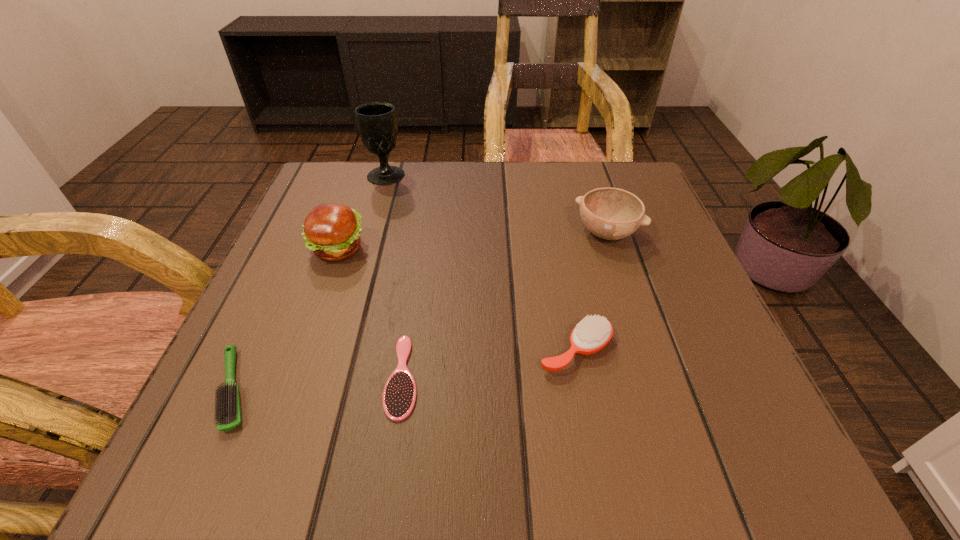
Identify the location of the tallest object. This screenshot has width=960, height=540. (376, 121).

Image resolution: width=960 pixels, height=540 pixels. In order to click on chalice in this screenshot , I will do `click(376, 121)`.

At what (x,y) coordinates should I click in order to perform the action: click on hamburger. Please return your answer as a coordinate pair (x, y). Image resolution: width=960 pixels, height=540 pixels. Looking at the image, I should click on (332, 231).

The width and height of the screenshot is (960, 540). What are the coordinates of `the fourth shortest object` in the screenshot? It's located at (610, 213).

This screenshot has height=540, width=960. Identify the location of the tallest hairbrush. (593, 333).

The image size is (960, 540). Find the location of `the rightmost hairbrush`. the rightmost hairbrush is located at coordinates (593, 333).

Where is `the second shortest hairbrush`? This screenshot has width=960, height=540. the second shortest hairbrush is located at coordinates (228, 411).

At what (x,y) coordinates should I click in order to perform the action: click on the second shortest object. Please return your answer as a coordinate pair (x, y). Looking at the image, I should click on (228, 411).

I want to click on the shortest object, so click(x=399, y=396).

Identify the location of the third object from right to left. Image resolution: width=960 pixels, height=540 pixels. (399, 396).